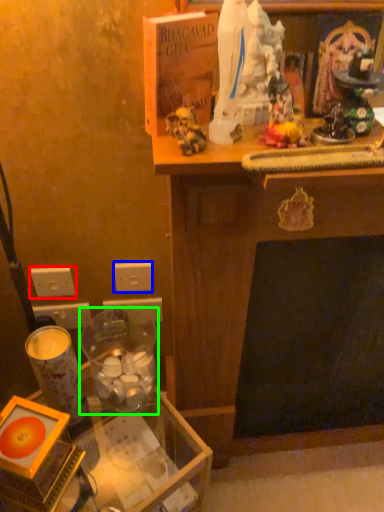
Question: Which is nearer to the electric outlet (highlighted by a red box)? electric outlet (highlighted by a blue box) or candle holder (highlighted by a green box).

Choices:
 (A) electric outlet
 (B) candle holder

Answer: (A)